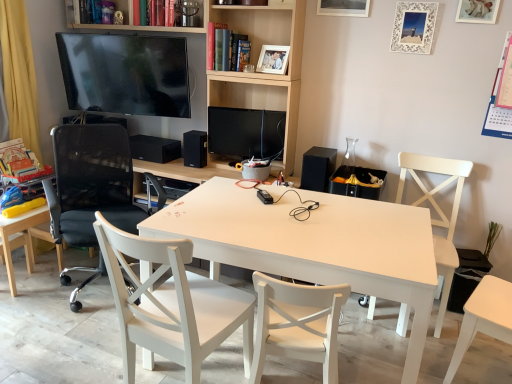
Locate an element on the screen. The height and width of the screenshot is (384, 512). vacant area that is in front of black mesh office chair at left, which is the 2th chair from left to right is located at coordinates (62, 340).